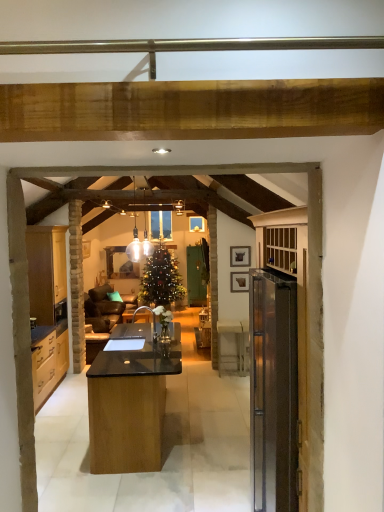
Question: Considering the relative sizes of white glass pendant light at center and wooden picture frame at upper right, which is the second picture frame from top to bottom, in the image provided, is white glass pendant light at center thinner than wooden picture frame at upper right, which is the second picture frame from top to bottom,?

Choices:
 (A) no
 (B) yes

Answer: (A)

Question: Are white glass pendant light at center and wooden picture frame at upper right, the 1th picture frame ordered from the bottom, making contact?

Choices:
 (A) yes
 (B) no

Answer: (B)

Question: From a real-world perspective, is white glass pendant light at center located higher than wooden picture frame at upper right, the 1th picture frame ordered from the bottom?

Choices:
 (A) no
 (B) yes

Answer: (B)

Question: From the image's perspective, would you say white glass pendant light at center is shown under wooden picture frame at upper right, which is the second picture frame from top to bottom?

Choices:
 (A) no
 (B) yes

Answer: (A)

Question: Is wooden picture frame at upper right, the 1th picture frame ordered from the bottom, at the back of white glass pendant light at center?

Choices:
 (A) yes
 (B) no

Answer: (B)

Question: Does white glass pendant light at center come behind wooden picture frame at upper right, the 1th picture frame ordered from the bottom?

Choices:
 (A) yes
 (B) no

Answer: (B)

Question: Is wooden picture frame at upper right, which is the second picture frame from top to bottom, smaller than white glass pendant light at center?

Choices:
 (A) yes
 (B) no

Answer: (A)

Question: Is wooden picture frame at upper right, the 1th picture frame ordered from the bottom, closer to the viewer compared to white glass pendant light at center?

Choices:
 (A) no
 (B) yes

Answer: (A)

Question: Considering the relative positions of wooden picture frame at upper right, the 1th picture frame ordered from the bottom, and white glass pendant light at center in the image provided, is wooden picture frame at upper right, the 1th picture frame ordered from the bottom, to the right of white glass pendant light at center from the viewer's perspective?

Choices:
 (A) no
 (B) yes

Answer: (B)

Question: Can you confirm if wooden picture frame at upper right, which is the second picture frame from top to bottom, is shorter than white glass pendant light at center?

Choices:
 (A) yes
 (B) no

Answer: (A)

Question: Is wooden picture frame at upper right, the 1th picture frame ordered from the bottom, oriented towards white glass pendant light at center?

Choices:
 (A) no
 (B) yes

Answer: (A)

Question: Is wooden picture frame at upper right, the 1th picture frame ordered from the bottom, looking in the opposite direction of white glass pendant light at center?

Choices:
 (A) no
 (B) yes

Answer: (A)

Question: From a real-world perspective, is white glass pendant light at center below matte wood cabinets at left?

Choices:
 (A) no
 (B) yes

Answer: (A)